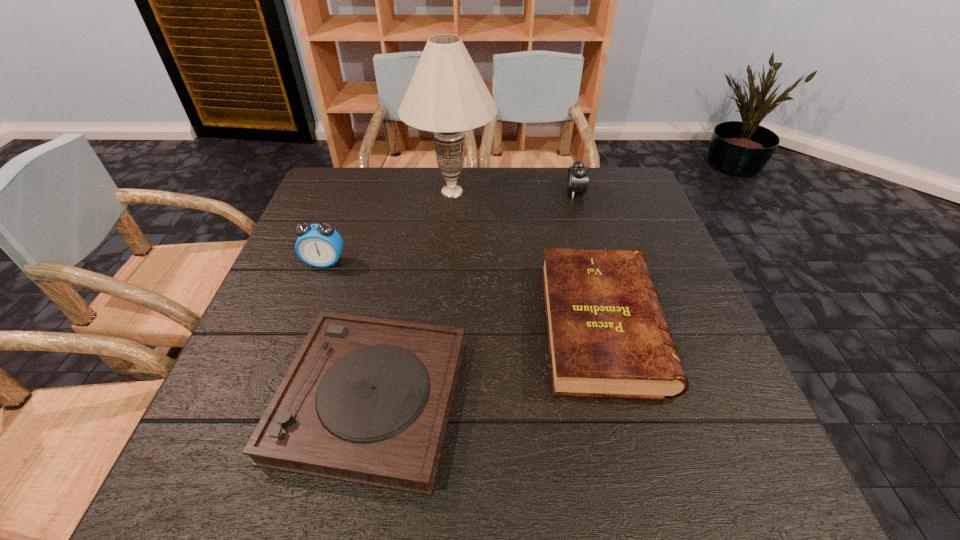
This screenshot has height=540, width=960. I want to click on lampshade, so click(x=446, y=95).

Where is `the taller alarm clock`? Image resolution: width=960 pixels, height=540 pixels. the taller alarm clock is located at coordinates (319, 245).

Identify the location of the third nearest object. Image resolution: width=960 pixels, height=540 pixels. (319, 245).

Where is `the right alarm clock`? the right alarm clock is located at coordinates (577, 181).

Find the location of a particular element. the farther alarm clock is located at coordinates (577, 181).

The height and width of the screenshot is (540, 960). Find the location of `hardback book`. hardback book is located at coordinates (608, 338).

Where is `phonograph record`? The image size is (960, 540). phonograph record is located at coordinates (366, 400).

Locate an element on the screen. The height and width of the screenshot is (540, 960). vacant space located on the front of the tallest object is located at coordinates (447, 242).

At what (x,y) coordinates should I click in order to perform the action: click on free spot located 0.370m on the face of the left alarm clock. Please return your answer as a coordinate pair (x, y). The height and width of the screenshot is (540, 960). Looking at the image, I should click on (271, 406).

This screenshot has width=960, height=540. What are the coordinates of `vacant region located on the front side of the shorter alarm clock` in the screenshot? It's located at (483, 192).